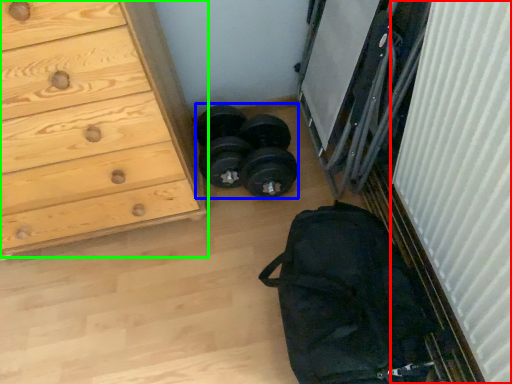
Question: Estimate the real-world distances between objects in this image. Which object is farther from curtain (highlighted by a red box), reel (highlighted by a blue box) or chest of drawers (highlighted by a green box)?

Choices:
 (A) reel
 (B) chest of drawers

Answer: (B)